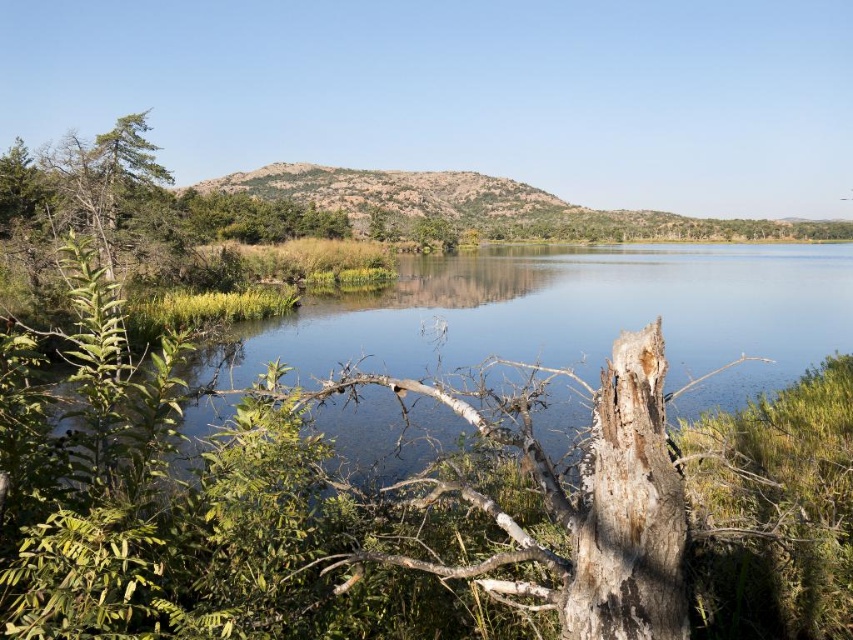
Question: Is clear water at center thinner than dark brown rough tree trunk at center?

Choices:
 (A) no
 (B) yes

Answer: (A)

Question: Which of the following is the farthest from the observer?

Choices:
 (A) (619, 529)
 (B) (811, 253)

Answer: (B)

Question: Is clear water at center thinner than dark brown rough tree trunk at center?

Choices:
 (A) no
 (B) yes

Answer: (A)

Question: Is the position of clear water at center less distant than that of dark brown rough tree trunk at center?

Choices:
 (A) no
 (B) yes

Answer: (A)